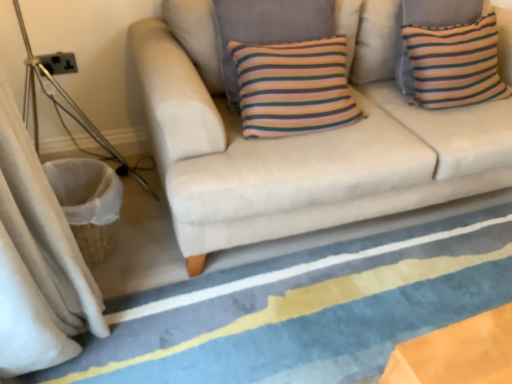
Question: From a real-world perspective, is beige fabric couch at center located beneath beige fabric curtain at left?

Choices:
 (A) yes
 (B) no

Answer: (A)

Question: From the image's perspective, is beige fabric couch at center over beige fabric curtain at left?

Choices:
 (A) no
 (B) yes

Answer: (B)

Question: Are beige fabric couch at center and beige fabric curtain at left located far from each other?

Choices:
 (A) yes
 (B) no

Answer: (B)

Question: Is beige fabric couch at center at the left side of beige fabric curtain at left?

Choices:
 (A) no
 (B) yes

Answer: (A)

Question: Considering the relative sizes of beige fabric couch at center and beige fabric curtain at left in the image provided, is beige fabric couch at center thinner than beige fabric curtain at left?

Choices:
 (A) no
 (B) yes

Answer: (A)

Question: Choose the correct answer: Is blue striped rug at lower center inside beige fabric couch at center or outside it?

Choices:
 (A) outside
 (B) inside

Answer: (A)

Question: Considering the positions of point (106, 365) and point (244, 241), is point (106, 365) closer or farther from the camera than point (244, 241)?

Choices:
 (A) closer
 (B) farther

Answer: (A)

Question: From a real-world perspective, is blue striped rug at lower center positioned above or below beige fabric couch at center?

Choices:
 (A) below
 (B) above

Answer: (A)

Question: Is blue striped rug at lower center wider or thinner than beige fabric couch at center?

Choices:
 (A) wide
 (B) thin

Answer: (A)

Question: Considering the positions of point (401, 124) and point (3, 231), is point (401, 124) closer or farther from the camera than point (3, 231)?

Choices:
 (A) closer
 (B) farther

Answer: (B)

Question: Considering the positions of beige fabric couch at center and beige fabric curtain at left in the image, is beige fabric couch at center taller or shorter than beige fabric curtain at left?

Choices:
 (A) short
 (B) tall

Answer: (A)

Question: Is beige fabric couch at center to the left or to the right of beige fabric curtain at left in the image?

Choices:
 (A) right
 (B) left

Answer: (A)

Question: From the image's perspective, is beige fabric couch at center above or below beige fabric curtain at left?

Choices:
 (A) below
 (B) above

Answer: (B)

Question: From the image's perspective, is beige fabric curtain at left located above or below striped fabric pillow at upper right?

Choices:
 (A) above
 (B) below

Answer: (B)

Question: Is beige fabric curtain at left bigger or smaller than striped fabric pillow at upper right?

Choices:
 (A) small
 (B) big

Answer: (B)